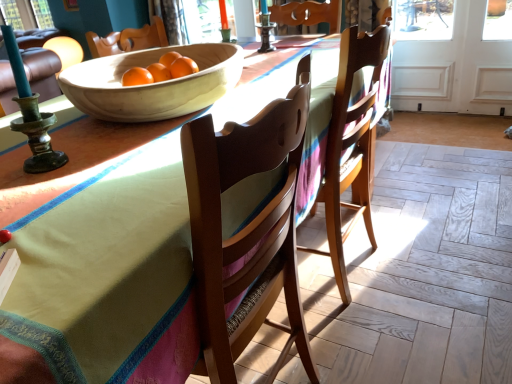
Question: Does point (221, 44) appear closer or farther from the camera than point (273, 26)?

Choices:
 (A) closer
 (B) farther

Answer: (A)

Question: Considering the positions of natural wood bowl at center and matte dark brown candle holder at upper center in the image, is natural wood bowl at center wider or thinner than matte dark brown candle holder at upper center?

Choices:
 (A) wide
 (B) thin

Answer: (A)

Question: Based on their relative distances, which object is farther from the white wood screen door at right?

Choices:
 (A) natural wood bowl at center
 (B) wooden table at center
 (C) matte dark brown candle holder at upper center

Answer: (A)

Question: Which of these objects is positioned closest to the wooden table at center?

Choices:
 (A) white wood screen door at right
 (B) matte dark brown candle holder at upper center
 (C) natural wood bowl at center

Answer: (C)